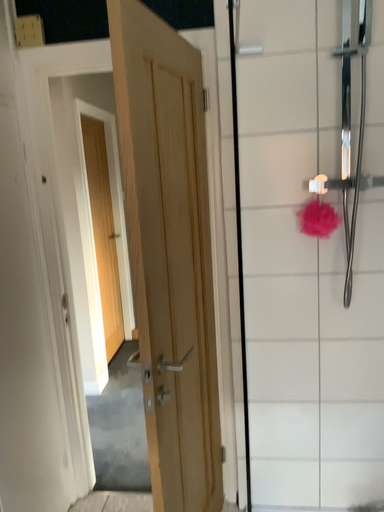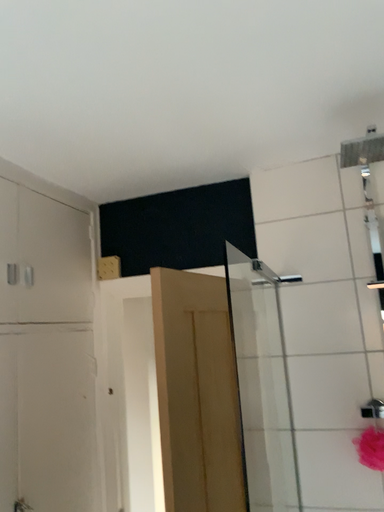
Question: How did the camera likely rotate when shooting the video?

Choices:
 (A) rotated downward
 (B) rotated upward

Answer: (B)